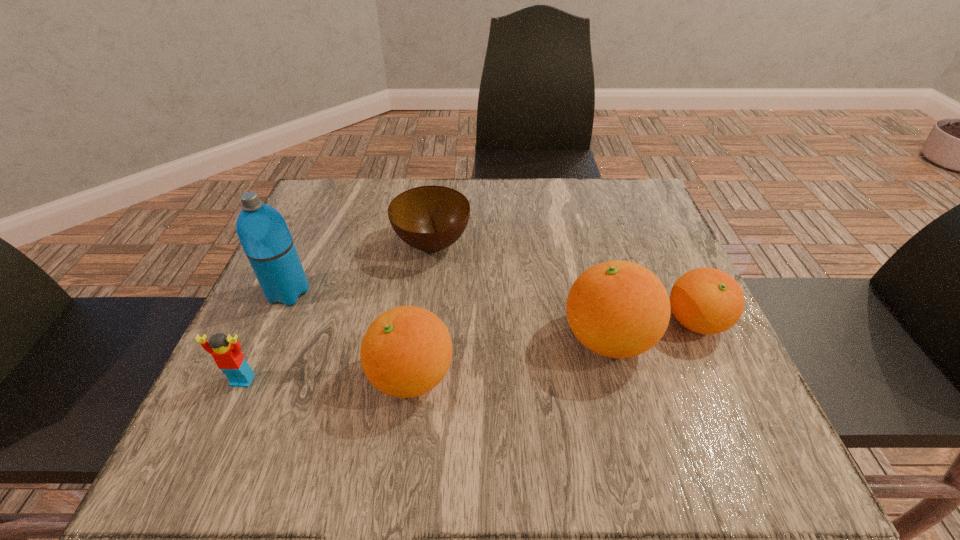
What are the coordinates of `the third tallest object` in the screenshot? It's located at [406, 351].

Where is `the leftmost orange`? This screenshot has width=960, height=540. the leftmost orange is located at coordinates (406, 351).

You are a GUI agent. You are given a task and a screenshot of the screen. Output one action in this format:
    pyautogui.click(x=<x>, y=<y>)
    Task: Click on the second object from right to left
    Image resolution: width=960 pixels, height=540 pixels.
    Given the screenshot: What is the action you would take?
    pyautogui.click(x=619, y=309)

Locate an element on the screen. This screenshot has height=540, width=960. the shortest orange is located at coordinates (705, 300).

Locate an element on the screen. The image size is (960, 540). the rightmost orange is located at coordinates (705, 300).

Find the location of a particular element. This screenshot has height=540, width=960. bowl is located at coordinates (429, 218).

In order to click on the farthest object in this screenshot , I will do pyautogui.click(x=429, y=218).

The height and width of the screenshot is (540, 960). Find the location of `thermos bottle`. thermos bottle is located at coordinates (264, 235).

You are a GUI agent. You are given a task and a screenshot of the screen. Output one action in this format:
    pyautogui.click(x=<x>, y=<y>)
    Task: Click on the Lego
    
    Given the screenshot: What is the action you would take?
    pyautogui.click(x=228, y=357)

At what (x,y) coordinates should I click in order to perform the action: click on vacant space located 0.130m on the left of the second tallest orange. Please return your answer as a coordinate pair (x, y). Looking at the image, I should click on (295, 376).